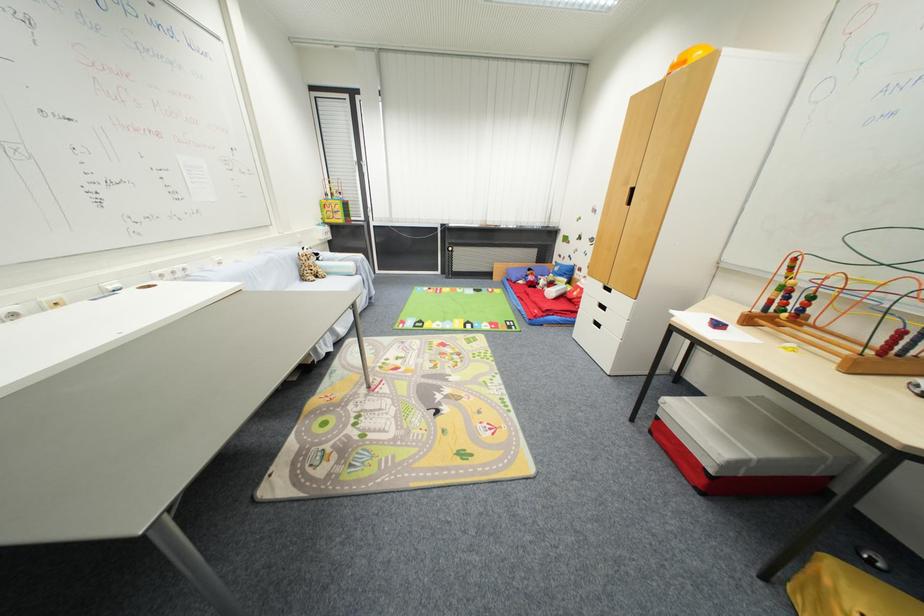
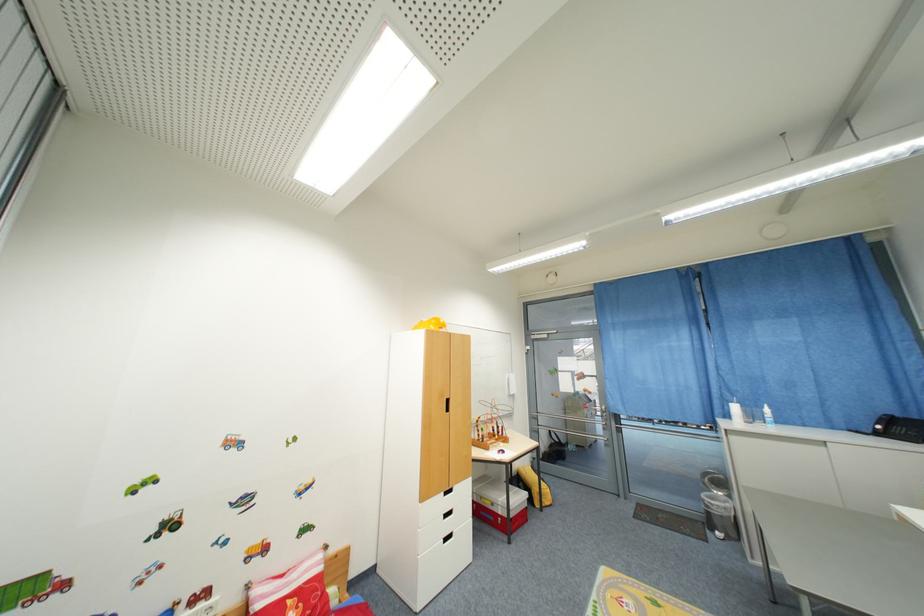
The point at (789, 313) is marked in the first image. Where is the corresponding point in the second image?

(500, 438)